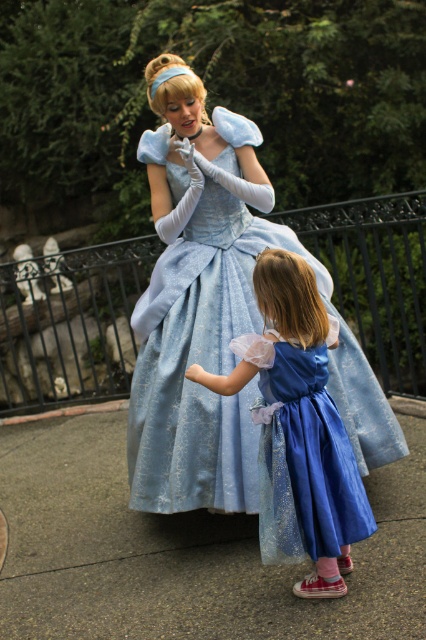
Is point (385, 429) closer to viewer compared to point (328, 464)?

No, (385, 429) is further to viewer.

Is point (342, 339) farther from camera compared to point (278, 307)?

Yes.

Who is more forward, (183, 481) or (264, 467)?

Point (264, 467) is more forward.

Locate an element on the screen. light blue satin dress at center is located at coordinates (201, 362).